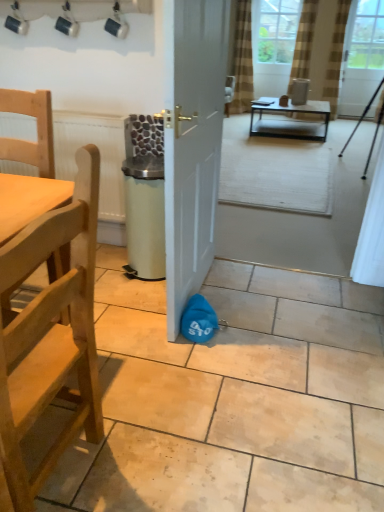
Identify the location of wooden chair at left, placed as the first chair when sorted from bottom to top. (50, 333).

Locate an element on the screen. light wood/rough chair at left, which ranks as the first chair in top-to-bottom order is located at coordinates (29, 164).

Identify the location of brown textured curtain at upper right, marked as the third curtain in a left-to-right arrangement. (304, 40).

How much space does brown textured curtain at upper right, marked as the third curtain in a left-to-right arrangement, occupy horizontally?

The width of brown textured curtain at upper right, marked as the third curtain in a left-to-right arrangement, is 21.75 centimeters.

How much space does clear glass window screen at upper center, acting as the second window screen starting from the right, occupy vertically?

clear glass window screen at upper center, acting as the second window screen starting from the right, is 37.72 inches in height.

The width and height of the screenshot is (384, 512). Describe the element at coordinates (192, 142) in the screenshot. I see `white glossy door at center` at that location.

Measure the distance between white glossy door at center and camera.

white glossy door at center and camera are 1.41 meters apart from each other.

Identify the location of clear glass door at upper right, positioned as the 2th window screen in left-to-right order. (361, 56).

What are the coordinates of `wooden chair at left, placed as the second chair when sorted from top to bottom` in the screenshot? It's located at (50, 333).

Based on the photo, from the image's perspective, which is below, brown textured curtain at upper right, which ranks as the 1th curtain in right-to-left order, or wooden chair at left, placed as the second chair when sorted from top to bottom?

wooden chair at left, placed as the second chair when sorted from top to bottom, from the image's perspective.

Is the depth of brown textured curtain at upper right, which ranks as the 1th curtain in right-to-left order, greater than that of wooden chair at left, placed as the first chair when sorted from bottom to top?

Yes.

From the image's perspective, starting from the brown textured curtain at upper right, marked as the third curtain in a left-to-right arrangement, which chair is the 2nd one below? Please provide its 2D coordinates.

[(50, 333)]

Between brown textured curtain at upper right, which ranks as the 1th curtain in right-to-left order, and wooden chair at left, placed as the first chair when sorted from bottom to top, which one has larger width?

wooden chair at left, placed as the first chair when sorted from bottom to top.

Which is more to the left, brown textured curtain at upper center, placed as the 2th curtain when sorted from left to right, or wooden chair at left, placed as the first chair when sorted from bottom to top?

wooden chair at left, placed as the first chair when sorted from bottom to top, is more to the left.

At what (x,y) coordinates should I click in order to perform the action: click on the 2nd curtain behind the wooden chair at left, placed as the second chair when sorted from top to bottom, starting your count from the anchor. Please return your answer as a coordinate pair (x, y). Looking at the image, I should click on (303, 42).

Could you tell me if brown textured curtain at upper center, which is counted as the 2th curtain, starting from the right, is facing wooden chair at left, placed as the first chair when sorted from bottom to top?

No, brown textured curtain at upper center, which is counted as the 2th curtain, starting from the right, is not turned towards wooden chair at left, placed as the first chair when sorted from bottom to top.

Is brown textured curtain at upper center, placed as the 2th curtain when sorted from left to right, bigger or smaller than wooden chair at left, placed as the second chair when sorted from top to bottom?

Clearly, brown textured curtain at upper center, placed as the 2th curtain when sorted from left to right, is smaller in size than wooden chair at left, placed as the second chair when sorted from top to bottom.

From the image's perspective, which is below, clear glass window screen at upper center, which is the first window screen in left-to-right order, or brown textured curtain at upper center, placed as the 2th curtain when sorted from left to right?

brown textured curtain at upper center, placed as the 2th curtain when sorted from left to right, from the image's perspective.

Is clear glass window screen at upper center, acting as the second window screen starting from the right, looking in the opposite direction of brown textured curtain at upper center, placed as the 2th curtain when sorted from left to right?

No, clear glass window screen at upper center, acting as the second window screen starting from the right, is not facing away from brown textured curtain at upper center, placed as the 2th curtain when sorted from left to right.

Is clear glass door at upper right, which is counted as the 1th window screen, starting from the right, closer to camera compared to light wood/rough chair at left, which is the 2th chair in bottom-to-top order?

No, it is not.

Choose the correct answer: Is clear glass door at upper right, positioned as the 2th window screen in left-to-right order, inside light wood/rough chair at left, which is the 2th chair in bottom-to-top order, or outside it?

clear glass door at upper right, positioned as the 2th window screen in left-to-right order, is not inside light wood/rough chair at left, which is the 2th chair in bottom-to-top order, it's outside.

Can you confirm if clear glass door at upper right, positioned as the 2th window screen in left-to-right order, is taller than light wood/rough chair at left, which is the 2th chair in bottom-to-top order?

Correct, clear glass door at upper right, positioned as the 2th window screen in left-to-right order, is much taller as light wood/rough chair at left, which is the 2th chair in bottom-to-top order.

Based on the photo, considering the sizes of objects clear glass door at upper right, which is counted as the 1th window screen, starting from the right, and light wood/rough chair at left, which is the 2th chair in bottom-to-top order, in the image provided, who is thinner, clear glass door at upper right, which is counted as the 1th window screen, starting from the right, or light wood/rough chair at left, which is the 2th chair in bottom-to-top order,?

clear glass door at upper right, which is counted as the 1th window screen, starting from the right.

Is brown textured curtain at upper right, which ranks as the 1th curtain in right-to-left order, not within clear glass window screen at upper center, acting as the second window screen starting from the right?

brown textured curtain at upper right, which ranks as the 1th curtain in right-to-left order, is positioned outside clear glass window screen at upper center, acting as the second window screen starting from the right.

Is brown textured curtain at upper right, marked as the third curtain in a left-to-right arrangement, at the right side of clear glass window screen at upper center, acting as the second window screen starting from the right?

Yes.

Based on their positions, is brown striped curtain at upper center, which appears as the 1th curtain when viewed from the left, located to the left or right of brown textured curtain at upper right, marked as the third curtain in a left-to-right arrangement?

In the image, brown striped curtain at upper center, which appears as the 1th curtain when viewed from the left, appears on the left side of brown textured curtain at upper right, marked as the third curtain in a left-to-right arrangement.

Does brown striped curtain at upper center, which appears as the 1th curtain when viewed from the left, have a greater height compared to brown textured curtain at upper right, marked as the third curtain in a left-to-right arrangement?

No.

In the scene shown: Considering the sizes of objects brown striped curtain at upper center, which appears as the 1th curtain when viewed from the left, and brown textured curtain at upper right, which ranks as the 1th curtain in right-to-left order, in the image provided, who is smaller, brown striped curtain at upper center, which appears as the 1th curtain when viewed from the left, or brown textured curtain at upper right, which ranks as the 1th curtain in right-to-left order,?

brown textured curtain at upper right, which ranks as the 1th curtain in right-to-left order.

Is brown striped curtain at upper center, which appears as the 1th curtain when viewed from the left, positioned with its back to brown textured curtain at upper right, which ranks as the 1th curtain in right-to-left order?

No, brown striped curtain at upper center, which appears as the 1th curtain when viewed from the left, is not facing the opposite direction of brown textured curtain at upper right, which ranks as the 1th curtain in right-to-left order.

Is point (306, 73) positioned behind point (20, 220)?

Yes, point (306, 73) is behind point (20, 220).

The width and height of the screenshot is (384, 512). Find the location of `curtain that is the 2nd one when counting backward from the light wood/rough chair at left, which ranks as the first chair in top-to-bottom order`. curtain that is the 2nd one when counting backward from the light wood/rough chair at left, which ranks as the first chair in top-to-bottom order is located at coordinates (303, 42).

Considering the relative sizes of brown textured curtain at upper center, placed as the 2th curtain when sorted from left to right, and light wood/rough chair at left, which is the 2th chair in bottom-to-top order, in the image provided, is brown textured curtain at upper center, placed as the 2th curtain when sorted from left to right, wider than light wood/rough chair at left, which is the 2th chair in bottom-to-top order,?

No.

From the image's perspective, is brown textured curtain at upper center, placed as the 2th curtain when sorted from left to right, located above or below light wood/rough chair at left, which ranks as the first chair in top-to-bottom order?

Based on their image positions, brown textured curtain at upper center, placed as the 2th curtain when sorted from left to right, is located above light wood/rough chair at left, which ranks as the first chair in top-to-bottom order.

Find the location of `curtain that is the 1st one when counting upward from the wooden chair at left, placed as the second chair when sorted from top to bottom (from the image's perspective)`. curtain that is the 1st one when counting upward from the wooden chair at left, placed as the second chair when sorted from top to bottom (from the image's perspective) is located at coordinates (304, 40).

From a real-world perspective, which chair is the 2nd one underneath the brown textured curtain at upper center, which is counted as the 2th curtain, starting from the right? Please provide its 2D coordinates.

[(50, 333)]

From the image, which object appears to be farther from brown striped curtain at upper center, which appears as the 1th curtain when viewed from the left, clear glass window screen at upper center, acting as the second window screen starting from the right, or light wood/rough chair at left, which ranks as the first chair in top-to-bottom order?

Based on the image, light wood/rough chair at left, which ranks as the first chair in top-to-bottom order, appears to be further to brown striped curtain at upper center, which appears as the 1th curtain when viewed from the left.

Based on their spatial positions, is brown striped curtain at upper center, which appears as the 1th curtain when viewed from the left, or light wood/rough chair at left, which is the 2th chair in bottom-to-top order, further from white glossy door at center?

brown striped curtain at upper center, which appears as the 1th curtain when viewed from the left, is further to white glossy door at center.

Based on their spatial positions, is metallic black coffee table at center or white glossy door at center closer to light wood/rough chair at left, which is the 2th chair in bottom-to-top order?

white glossy door at center is positioned closer to the anchor light wood/rough chair at left, which is the 2th chair in bottom-to-top order.

Estimate the real-world distances between objects in this image. Which object is closer to brown striped curtain at upper center, which appears as the 1th curtain when viewed from the left, clear glass door at upper right, which is counted as the 1th window screen, starting from the right, or brown textured curtain at upper center, placed as the 2th curtain when sorted from left to right?

Among the two, brown textured curtain at upper center, placed as the 2th curtain when sorted from left to right, is located nearer to brown striped curtain at upper center, which appears as the 1th curtain when viewed from the left.

Which object lies nearer to the anchor point metallic black coffee table at center, clear glass window screen at upper center, acting as the second window screen starting from the right, or brown striped curtain at upper center, arranged as the 3th curtain when viewed from the right?

brown striped curtain at upper center, arranged as the 3th curtain when viewed from the right, lies closer to metallic black coffee table at center than the other object.

Looking at the image, which one is located closer to wooden chair at left, placed as the second chair when sorted from top to bottom, metallic black coffee table at center or light wood/rough chair at left, which is the 2th chair in bottom-to-top order?

light wood/rough chair at left, which is the 2th chair in bottom-to-top order, is closer to wooden chair at left, placed as the second chair when sorted from top to bottom.

Based on their spatial positions, is clear glass window screen at upper center, which is the first window screen in left-to-right order, or white glossy door at center further from metallic black coffee table at center?

Based on the image, white glossy door at center appears to be further to metallic black coffee table at center.

Looking at the image, which one is located further to metallic black coffee table at center, brown textured curtain at upper right, marked as the third curtain in a left-to-right arrangement, or white glossy door at center?

Based on the image, white glossy door at center appears to be further to metallic black coffee table at center.

Identify the location of window screen between white glossy door at center and brown textured curtain at upper right, which ranks as the 1th curtain in right-to-left order, in the front-back direction. (361, 56).

This screenshot has width=384, height=512. I want to click on window screen located between light wood/rough chair at left, which is the 2th chair in bottom-to-top order, and brown textured curtain at upper right, which ranks as the 1th curtain in right-to-left order, in the depth direction, so click(361, 56).

The image size is (384, 512). What are the coordinates of `chair between light wood/rough chair at left, which is the 2th chair in bottom-to-top order, and white glossy door at center` in the screenshot? It's located at (50, 333).

Identify the location of curtain between white glossy door at center and brown textured curtain at upper center, placed as the 2th curtain when sorted from left to right, from front to back. The height and width of the screenshot is (512, 384). (304, 40).